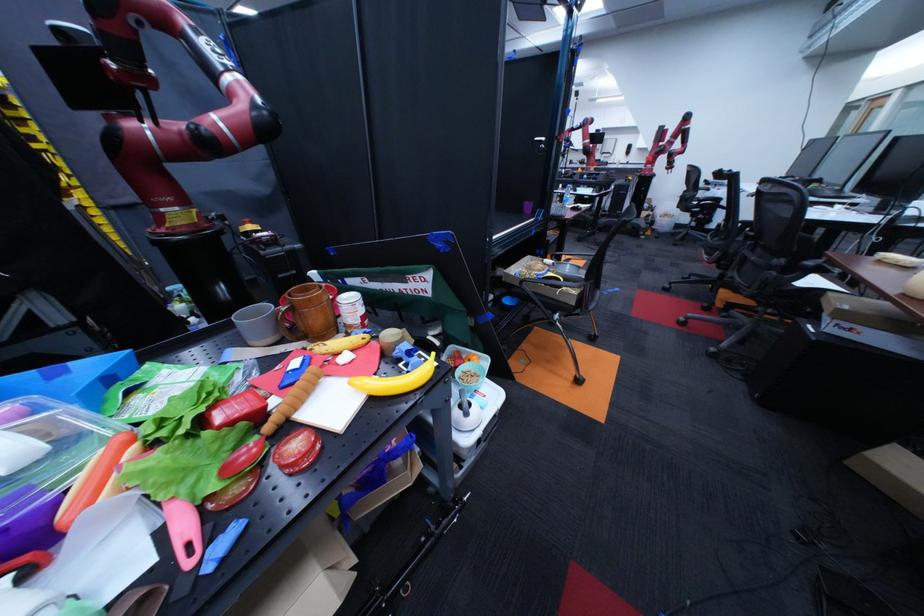
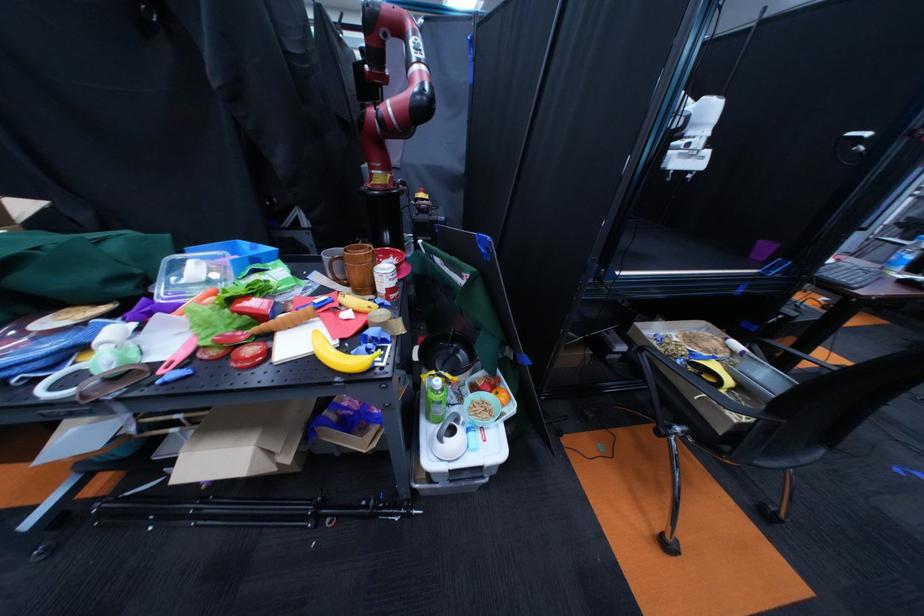
Locate, in the second image, the point that corresponds to point 274,392 in the first image.

(305, 307)